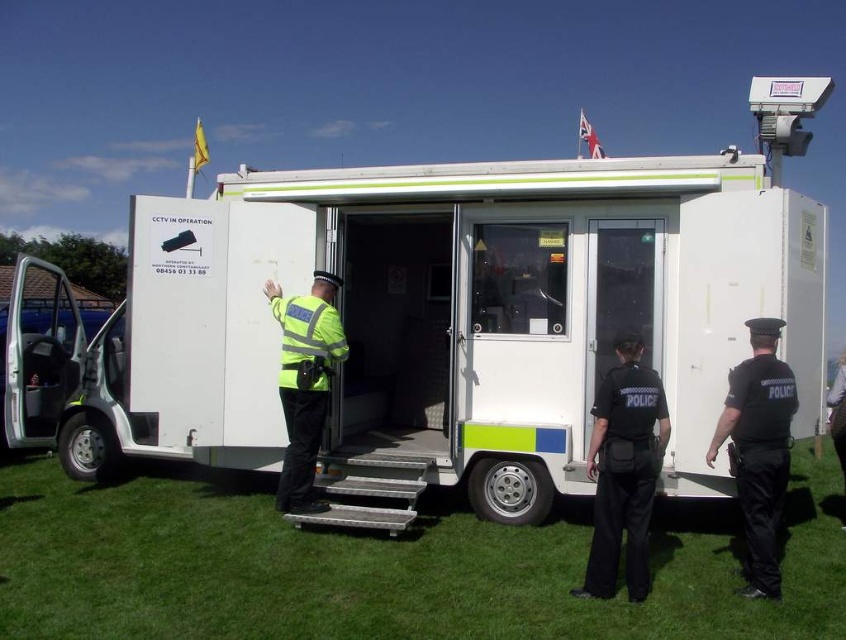
You are a police officer who needs to inspect the white plastic trailer at center from a safe distance. What is the minimum distance you should maintain to ensure safety?

The minimum safe distance to maintain is 6.00 meters from the white plastic trailer at center.

What is the exact coordinate of the white plastic trailer at center?

The white plastic trailer at center is located at point (452, 323).